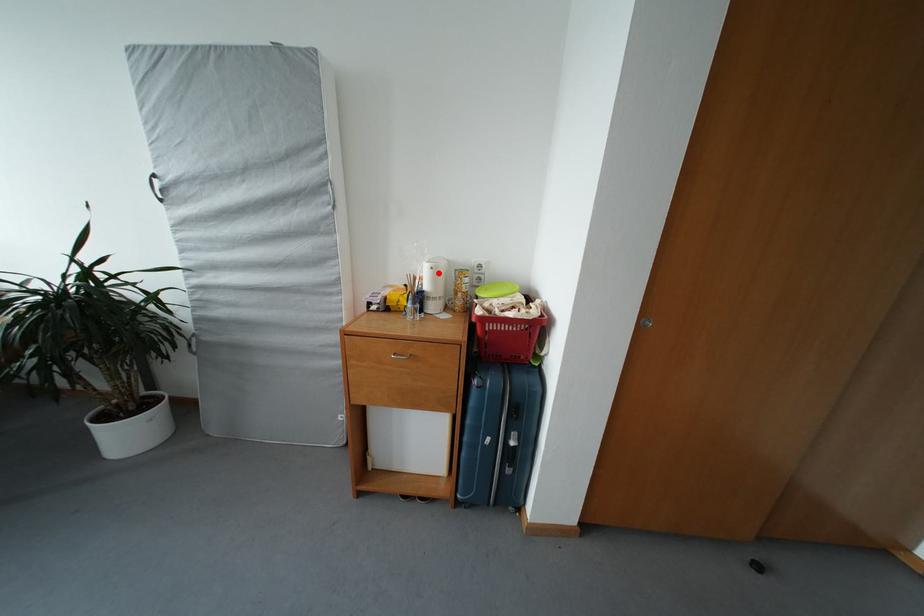
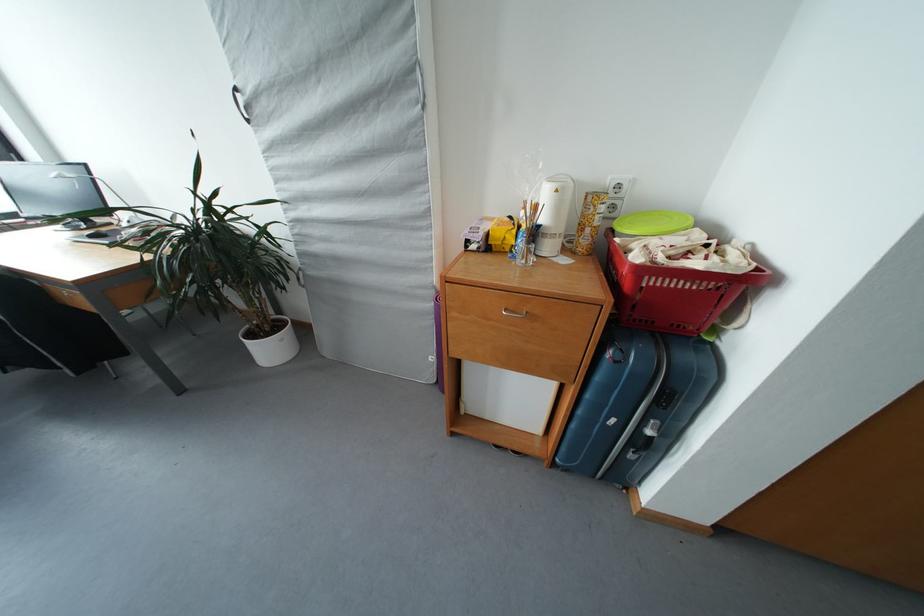
The point at the highlighted location is marked in the first image. Where is the corresponding point in the second image?

(563, 196)